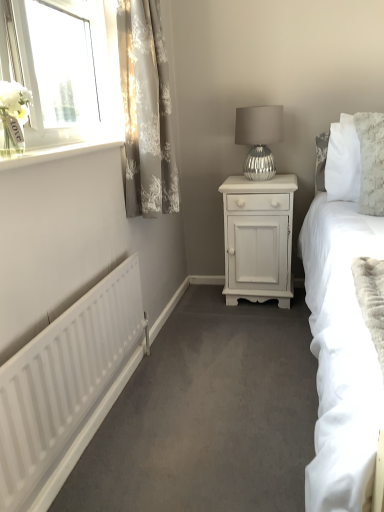
This screenshot has width=384, height=512. I want to click on free area in between white painted wood nightstand at center and white matte radiator at lower left, so click(197, 364).